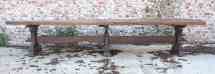
Where is `wall`? The image size is (215, 74). wall is located at coordinates (116, 11).